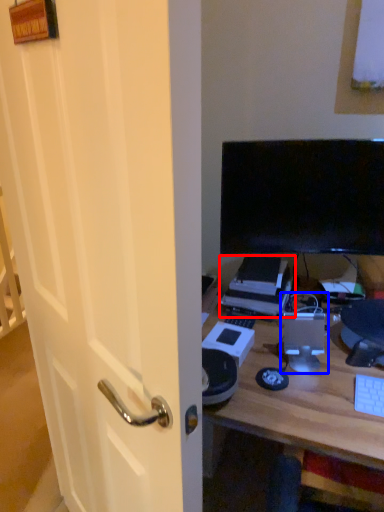
Question: Which object appears closest to the camera in this image, printer (highlighted by a red box) or computer tower (highlighted by a blue box)?

Choices:
 (A) printer
 (B) computer tower

Answer: (B)